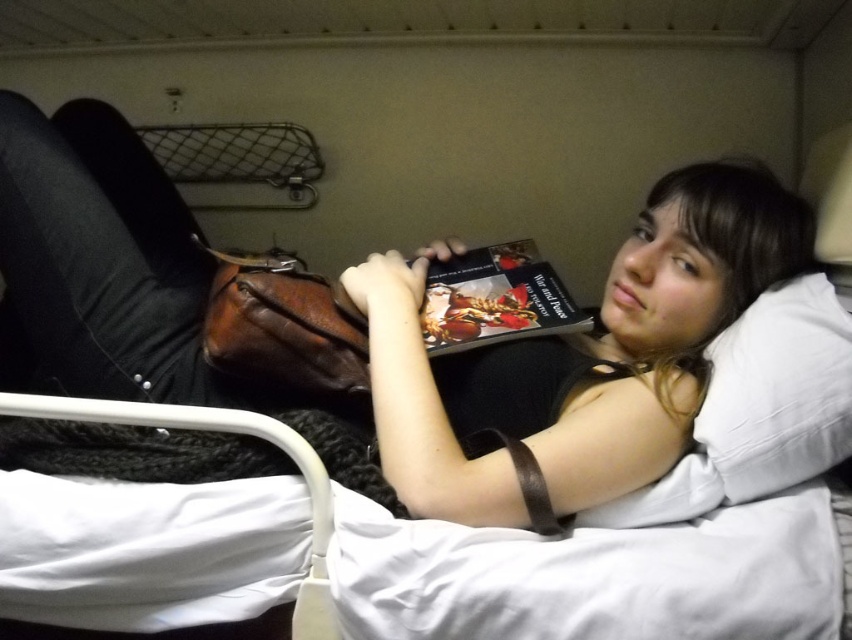
Does matte black book at upper center appear over hardcover book at center?

Yes.

Find the location of a particular element. matte black book at upper center is located at coordinates (389, 330).

Is matte black book at upper center bigger than white soft pillow at upper right?

Indeed, matte black book at upper center has a larger size compared to white soft pillow at upper right.

Can you confirm if matte black book at upper center is taller than white soft pillow at upper right?

Yes.

Identify the location of matte black book at upper center. (389, 330).

Is the position of white soft pillow at upper right more distant than that of hardcover book at center?

No, white soft pillow at upper right is closer to the viewer.

Between point (709, 396) and point (533, 308), which one is positioned in front?

Positioned in front is point (709, 396).

The image size is (852, 640). I want to click on white soft pillow at upper right, so click(x=774, y=396).